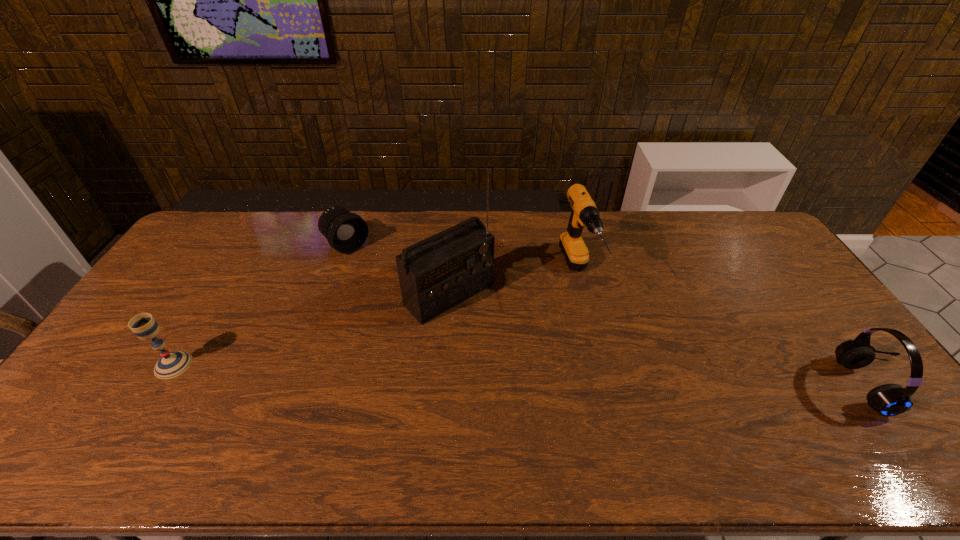
Image resolution: width=960 pixels, height=540 pixels. Find the location of `free space between the second tallest object and the radio receiver`. free space between the second tallest object and the radio receiver is located at coordinates (513, 284).

Where is `vacant area between the headset and the shortest object`? The width and height of the screenshot is (960, 540). vacant area between the headset and the shortest object is located at coordinates (613, 315).

What are the coordinates of `free spot between the shortest object and the chalice` in the screenshot? It's located at (260, 305).

Where is `free space between the radio receiver and the headset`? The width and height of the screenshot is (960, 540). free space between the radio receiver and the headset is located at coordinates (665, 340).

Find the location of `blank region between the drill and the radio receiver`. blank region between the drill and the radio receiver is located at coordinates (513, 284).

This screenshot has height=540, width=960. In order to click on vacant point located between the fourth object from left to right and the headset in this screenshot , I will do `click(729, 329)`.

Identify the location of object that is the fourth closest one to the third object from right to left. Image resolution: width=960 pixels, height=540 pixels. (888, 400).

Select which object is the fourth closest to the drill. Please provide its 2D coordinates. Your answer should be formatted as a tuple, i.e. [(x, y)], where the tuple contains the x and y coordinates of a point satisfying the conditions above.

[(172, 364)]

Locate an element on the screen. vacant space that satisfies the following two spatial constraints: 1. on the front side of the shortest object; 2. on the right side of the drill is located at coordinates (337, 273).

Find the location of a particular element. This screenshot has width=960, height=540. free space that satisfies the following two spatial constraints: 1. on the front side of the tallest object; 2. on the ear cushions of the rightmost object is located at coordinates (443, 386).